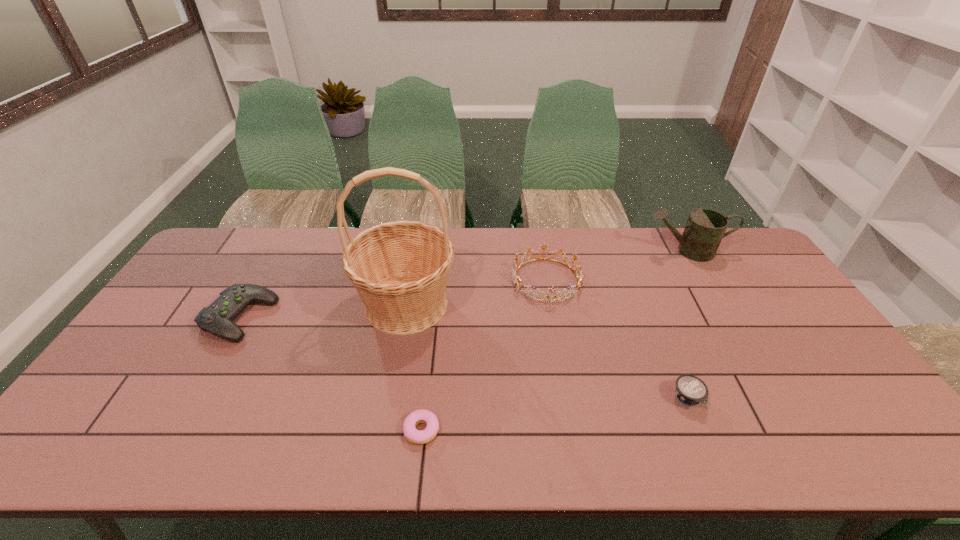
Select which object is the third closest to the control. Please provide its 2D coordinates. Your answer should be formatted as a tuple, i.e. [(x, y)], where the tuple contains the x and y coordinates of a point satisfying the conditions above.

[(516, 279)]

Identify the location of vacant space that satisfies the following two spatial constraints: 1. on the front-facing side of the second object from right to left; 2. on the right side of the third tallest object. This screenshot has height=540, width=960. (566, 399).